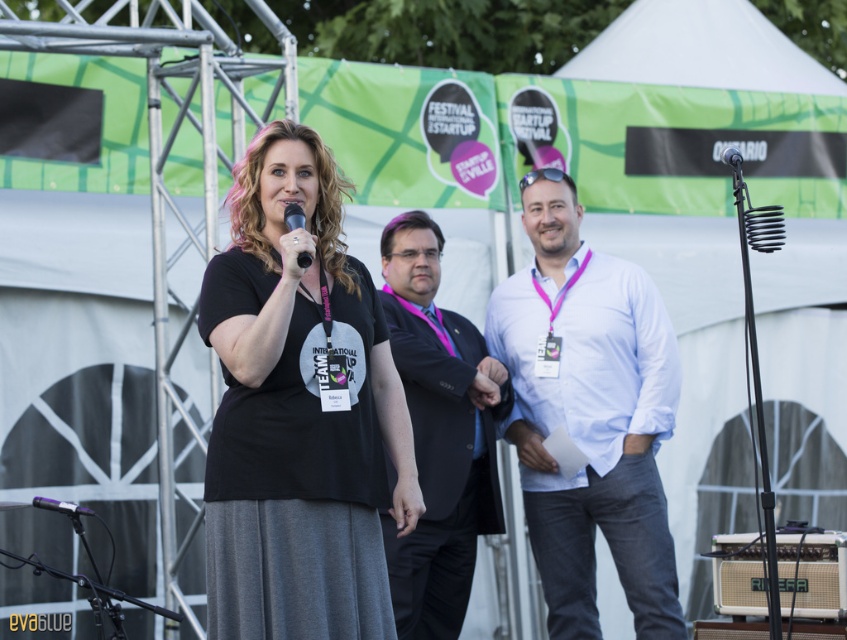
You are an event photographer at the Festival International Startup. You need to take a photo that includes both the white cotton shirt at center and the beige fabric speaker at lower right. Based on their positions, which object should be placed on the left side of the photo?

The white cotton shirt at center should be placed on the left side of the photo because it is to the left of the beige fabric speaker at lower right.

You are an event photographer at the Festival International Startup. You need to capture a clear photo of the white cotton shirt at center and the metallic purple microphone at lower left. Can you focus on both objects simultaneously without adjusting your camera settings?

The metallic purple microphone at lower left is behind the white cotton shirt at center, so focusing on both simultaneously may be challenging unless your camera has a large depth of field. Adjusting the aperture to a higher fstop number would increase the depth of field, allowing both objects to be in focus.